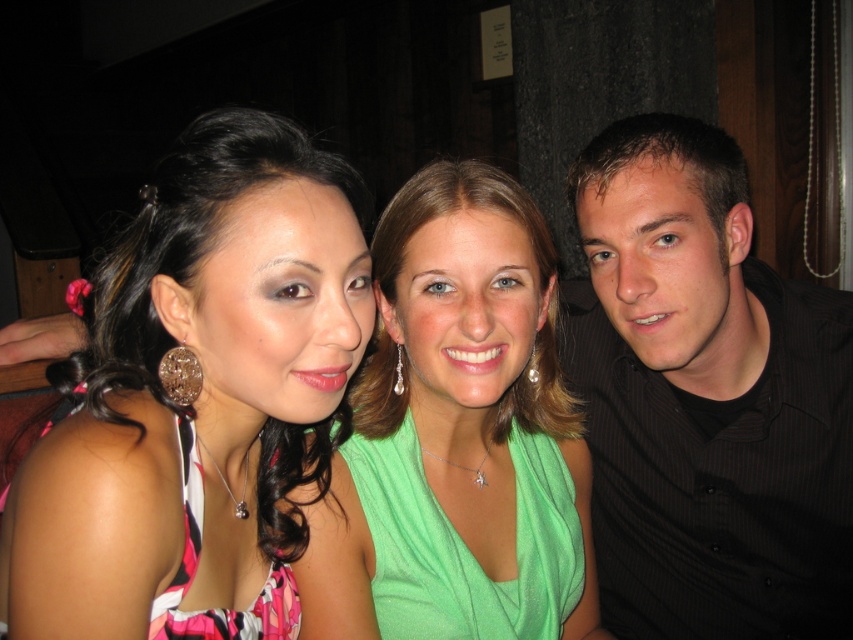
You are standing at the point with coordinates point (x=805, y=394) and want to move to the point with coordinates point (x=352, y=433). Which direction should you move to reach there?

To reach point (x=352, y=433) from point (x=805, y=394), you should move forward since point (x=805, y=394) is behind point (x=352, y=433).

You are a photographer trying to adjust the lighting for a group photo. You notice the pink printed dress at center and the black striped shirt at right. Which clothing item should you focus the light on to ensure it stands out more, considering their sizes in the frame?

The pink printed dress at center is not as tall as the black striped shirt at right, so focusing the light on the pink printed dress at center would help it stand out more in the frame.

You are a photographer trying to adjust the lighting for a group photo. You need to ensure that the black striped shirt at right and the green satin dress at center are both well lit. Based on their positions, which clothing item is positioned higher in the frame?

The black striped shirt at right is above the green satin dress at center, so it is positioned higher in the frame and may require more attention to ensure proper lighting without overexposing it.